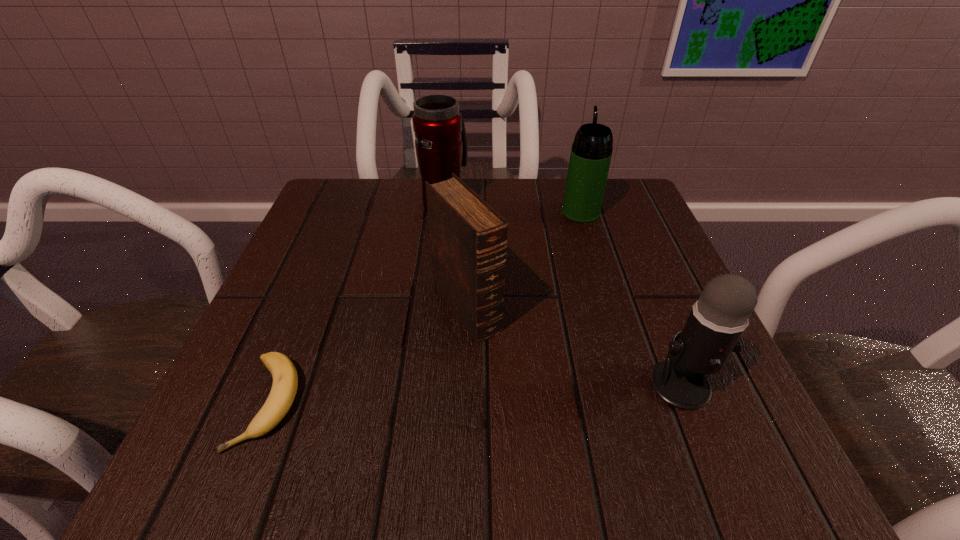
Where is `free space at the far right corner of the desktop`? free space at the far right corner of the desktop is located at coordinates (606, 205).

Identify the location of vacant area that lies between the Bible and the leftmost object. Image resolution: width=960 pixels, height=540 pixels. (368, 355).

This screenshot has height=540, width=960. I want to click on unoccupied area between the left thermos bottle and the microphone, so click(x=563, y=293).

I want to click on free space between the microphone and the third nearest object, so tap(574, 347).

Identify the location of vacant space in between the microphone and the left thermos bottle. (563, 293).

The image size is (960, 540). I want to click on blank region between the right thermos bottle and the leftmost object, so click(x=424, y=307).

Locate an element on the screen. vacant space in between the leftmost object and the right thermos bottle is located at coordinates (424, 307).

I want to click on free space between the leftmost object and the right thermos bottle, so click(x=424, y=307).

Find the location of a particular element. The image size is (960, 540). free spot between the Bible and the leftmost object is located at coordinates (368, 355).

Find the location of a particular element. The height and width of the screenshot is (540, 960). blank region between the microphone and the right thermos bottle is located at coordinates (631, 299).